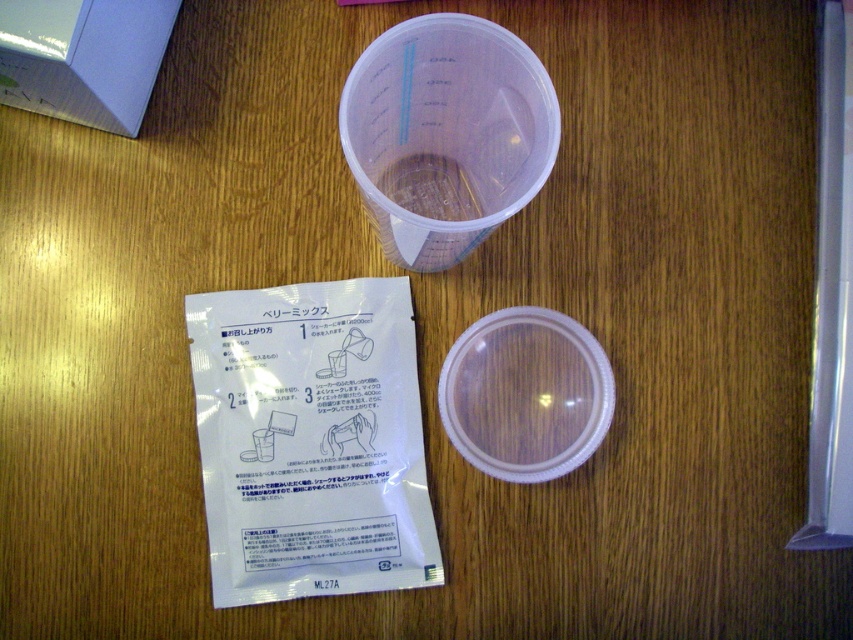
Question: Which of the following is the farthest from the observer?

Choices:
 (A) matte white box at upper left
 (B) white matte packet at lower left

Answer: (B)

Question: Does white matte packet at lower left appear on the left side of matte white box at upper left?

Choices:
 (A) no
 (B) yes

Answer: (A)

Question: Is white matte packet at lower left below matte white box at upper left?

Choices:
 (A) no
 (B) yes

Answer: (B)

Question: Does white matte packet at lower left appear on the left side of matte white box at upper left?

Choices:
 (A) no
 (B) yes

Answer: (A)

Question: Among these points, which one is nearest to the camera?

Choices:
 (A) (41, 20)
 (B) (216, 317)

Answer: (A)